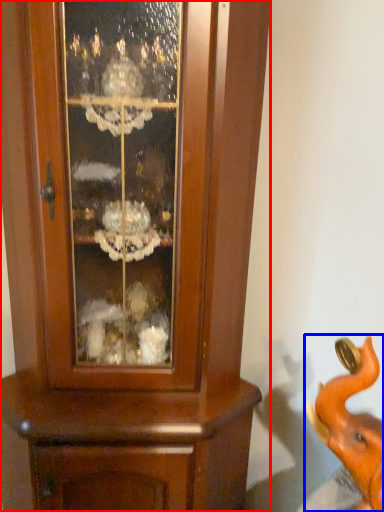
Question: Which object is closer to the camera taking this photo, cupboard (highlighted by a red box) or elephant (highlighted by a blue box)?

Choices:
 (A) cupboard
 (B) elephant

Answer: (B)